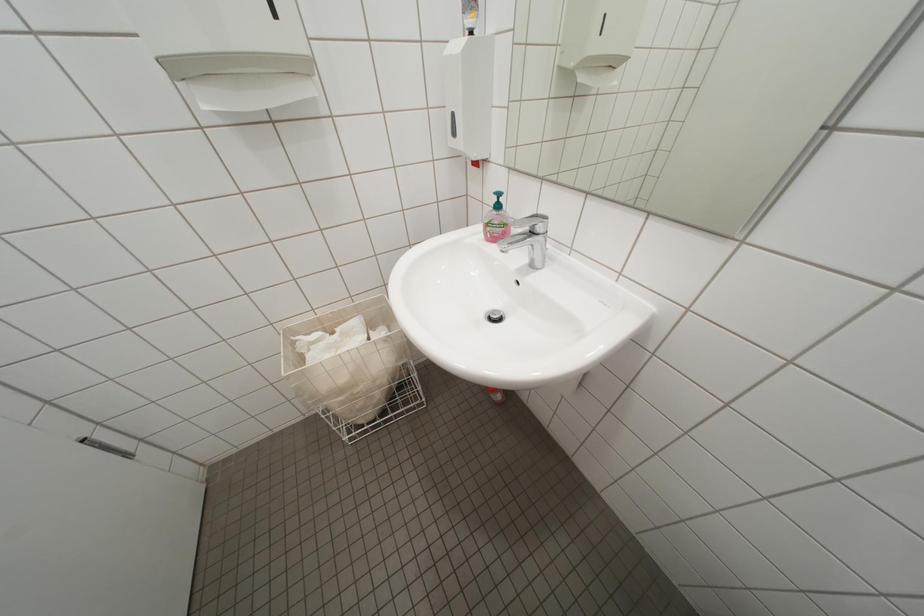
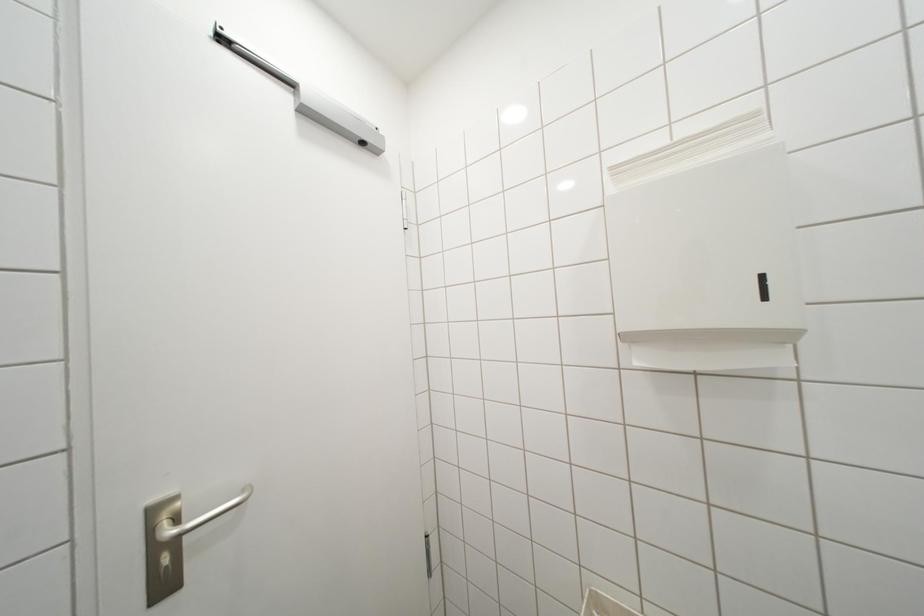
Question: The camera is either moving clockwise (left) or counter-clockwise (right) around the object. The first image is from the beginning of the video and the second image is from the end. Is the camera moving left or right when shooting the video?

Choices:
 (A) Left
 (B) Right

Answer: (B)